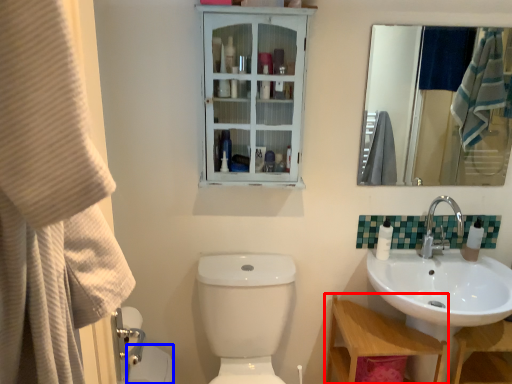
Question: Which object is further to the camera taking this photo, table (highlighted by a red box) or toilet bowl (highlighted by a blue box)?

Choices:
 (A) table
 (B) toilet bowl

Answer: (B)